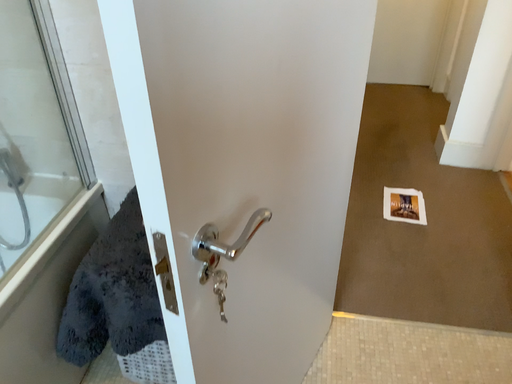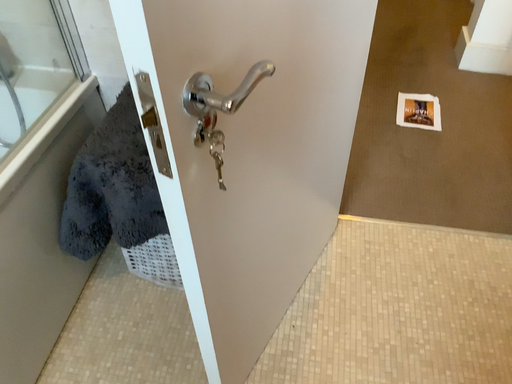
Question: Which way did the camera rotate in the video?

Choices:
 (A) rotated downward
 (B) rotated upward

Answer: (A)